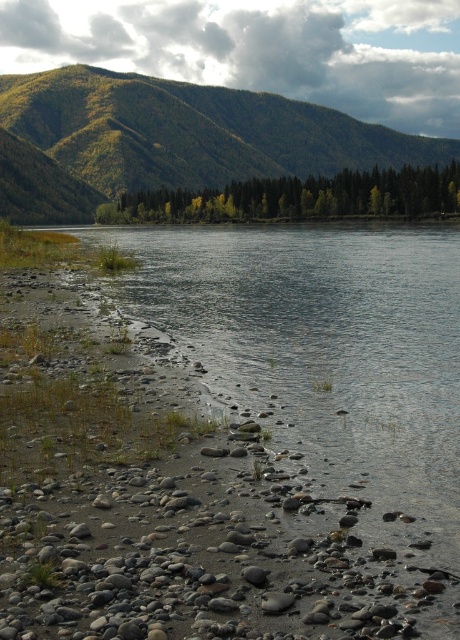
Question: Which point is farther to the camera?

Choices:
 (A) green matte trees at center
 (B) green forested mountain at upper center

Answer: (B)

Question: Which point is closer to the camera?

Choices:
 (A) green matte trees at center
 (B) green forested mountain at upper center

Answer: (A)

Question: Which object is closer to the camera taking this photo?

Choices:
 (A) green forested mountain at upper center
 (B) green matte trees at center

Answer: (B)

Question: Is green forested mountain at upper center below green matte trees at center?

Choices:
 (A) yes
 (B) no

Answer: (B)

Question: Observing the image, what is the correct spatial positioning of green forested mountain at upper center in reference to green matte trees at center?

Choices:
 (A) below
 (B) above

Answer: (B)

Question: Is green forested mountain at upper center smaller than green matte trees at center?

Choices:
 (A) yes
 (B) no

Answer: (B)